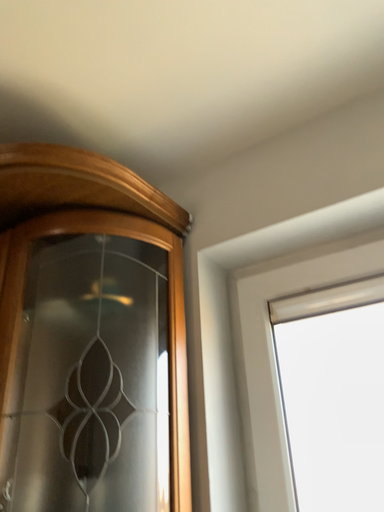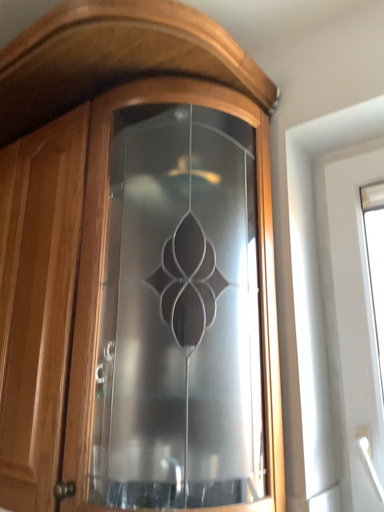
Question: How did the camera likely rotate when shooting the video?

Choices:
 (A) rotated downward
 (B) rotated upward

Answer: (A)